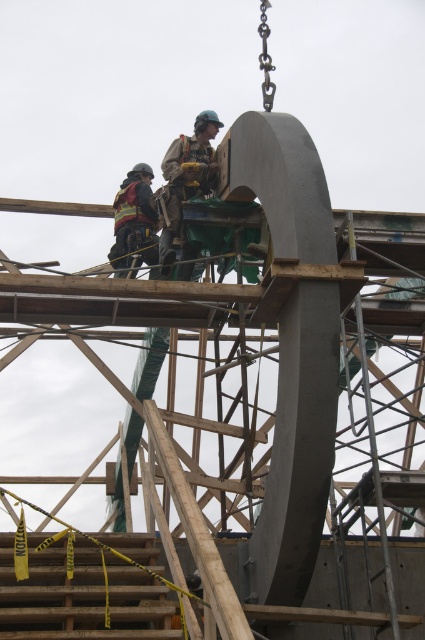
Who is more distant from viewer, (172, 156) or (119, 209)?

The point (119, 209) is behind.

Can you confirm if camouflage fabric safety vest at center is shorter than reflective safety vest at left?

No, camouflage fabric safety vest at center is not shorter than reflective safety vest at left.

I want to click on camouflage fabric safety vest at center, so click(187, 177).